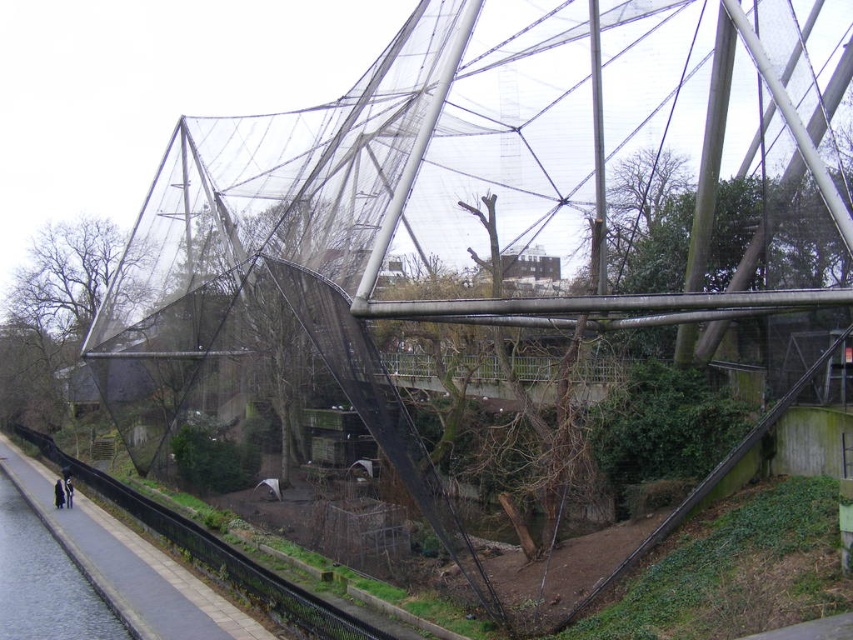
How much distance is there between dark blue fabric at lower left and dark blue jacket at lower left?

dark blue fabric at lower left is 34.02 inches from dark blue jacket at lower left.

Can you confirm if dark blue fabric at lower left is shorter than dark blue jacket at lower left?

No.

The height and width of the screenshot is (640, 853). What do you see at coordinates (57, 493) in the screenshot?
I see `dark blue fabric at lower left` at bounding box center [57, 493].

You are a GUI agent. You are given a task and a screenshot of the screen. Output one action in this format:
    pyautogui.click(x=<x>, y=<y>)
    Task: Click on the dark blue fabric at lower left
    
    Given the screenshot: What is the action you would take?
    pyautogui.click(x=57, y=493)

Does point (115, 529) lie in front of point (9, 560)?

No, (115, 529) is behind (9, 560).

Between point (83, 522) and point (77, 609), which one is positioned in front?

Positioned in front is point (77, 609).

Where is `concrete sidewalk at lower left`? This screenshot has width=853, height=640. concrete sidewalk at lower left is located at coordinates (152, 580).

Is smooth gray water at lower left above dark blue jacket at lower left?

Actually, smooth gray water at lower left is below dark blue jacket at lower left.

Who is positioned more to the left, smooth gray water at lower left or dark blue jacket at lower left?

From the viewer's perspective, dark blue jacket at lower left appears more on the left side.

Describe the element at coordinates (44, 580) in the screenshot. The width and height of the screenshot is (853, 640). I see `smooth gray water at lower left` at that location.

This screenshot has width=853, height=640. Find the location of `smooth gray water at lower left`. smooth gray water at lower left is located at coordinates (44, 580).